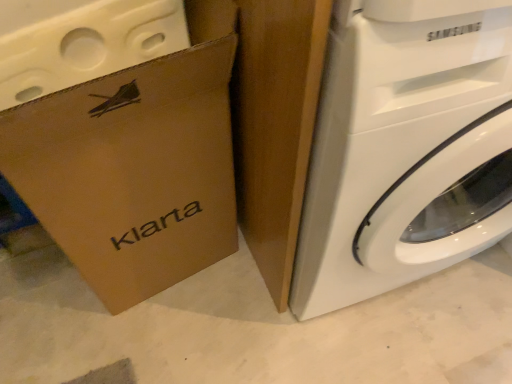
Question: Is the depth of white glossy washing machine at right less than that of brown cardboard box at left?

Choices:
 (A) no
 (B) yes

Answer: (B)

Question: From the image's perspective, is white glossy washing machine at right below brown cardboard box at left?

Choices:
 (A) yes
 (B) no

Answer: (B)

Question: Can you confirm if white glossy washing machine at right is thinner than brown cardboard box at left?

Choices:
 (A) yes
 (B) no

Answer: (B)

Question: From a real-world perspective, is white glossy washing machine at right positioned over brown cardboard box at left based on gravity?

Choices:
 (A) yes
 (B) no

Answer: (A)

Question: Considering the relative sizes of white glossy washing machine at right and brown cardboard box at left in the image provided, is white glossy washing machine at right smaller than brown cardboard box at left?

Choices:
 (A) yes
 (B) no

Answer: (B)

Question: Is white glossy washing machine at right shorter than brown cardboard box at left?

Choices:
 (A) no
 (B) yes

Answer: (A)

Question: Can you confirm if brown cardboard box at left is positioned to the right of white glossy washing machine at right?

Choices:
 (A) no
 (B) yes

Answer: (A)

Question: Can we say brown cardboard box at left lies outside white glossy washing machine at right?

Choices:
 (A) yes
 (B) no

Answer: (A)

Question: Is brown cardboard box at left at the left side of white glossy washing machine at right?

Choices:
 (A) yes
 (B) no

Answer: (A)

Question: Is brown cardboard box at left with white glossy washing machine at right?

Choices:
 (A) no
 (B) yes

Answer: (A)

Question: From the image's perspective, is brown cardboard box at left under white glossy washing machine at right?

Choices:
 (A) no
 (B) yes

Answer: (B)

Question: Can you confirm if brown cardboard box at left is smaller than white glossy washing machine at right?

Choices:
 (A) yes
 (B) no

Answer: (A)

Question: Looking at their shapes, would you say white glossy washing machine at right is wider or thinner than brown cardboard box at left?

Choices:
 (A) wide
 (B) thin

Answer: (A)